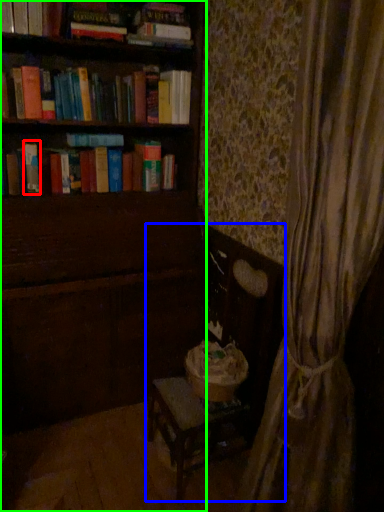
Question: Based on their relative distances, which object is farther from paperback book (highlighted by a red box)? Choose from rocking chair (highlighted by a blue box) and furniture (highlighted by a green box).

Choices:
 (A) rocking chair
 (B) furniture

Answer: (A)